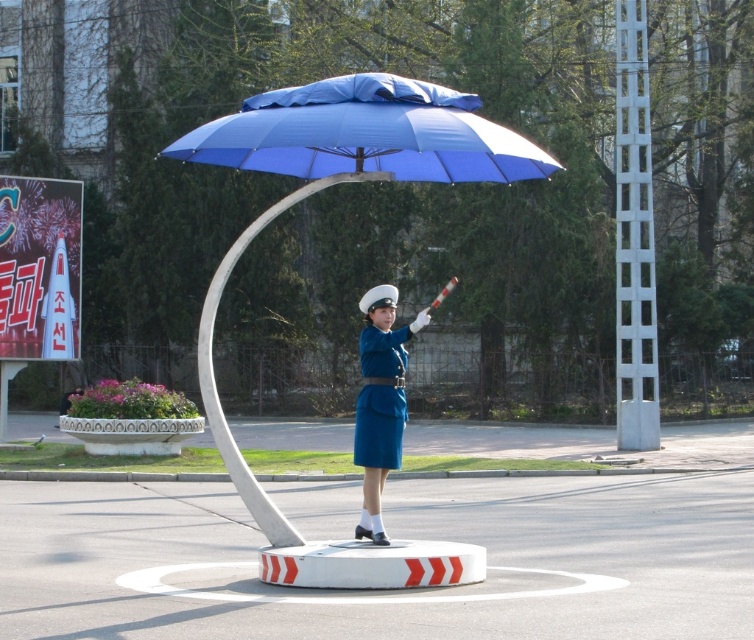
You are a photographer planning to take a portrait of the person under the blue matte umbrella at center and in the blue fabric uniform at center. To ensure the umbrella covers the person fully, what should you consider based on their sizes?

The blue matte umbrella at center is taller than the blue fabric uniform at center, so positioning the person directly under the umbrella would ensure full coverage since the umbrella extends higher than the person.

You are a photographer positioned at the edge of the scene. You need to capture a clear photo of both the blue fabric uniform at center and the blue matte uniform at center without any overlap. Given that your camera has a minimum focus distance of 28 inches, can you take the photo from your current position?

The blue fabric uniform at center is 27.40 inches away from blue matte uniform at center. Since the distance between them is less than the camera minimum focus distance of 28 inches, you cannot take the photo from your current position without overlap.